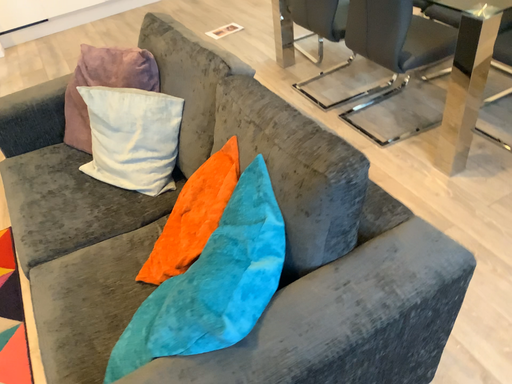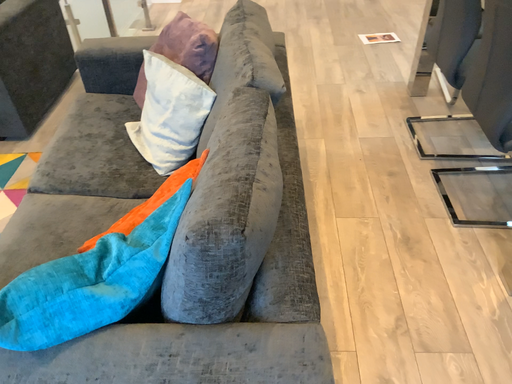
Question: How did the camera likely rotate when shooting the video?

Choices:
 (A) rotated left
 (B) rotated right

Answer: (A)